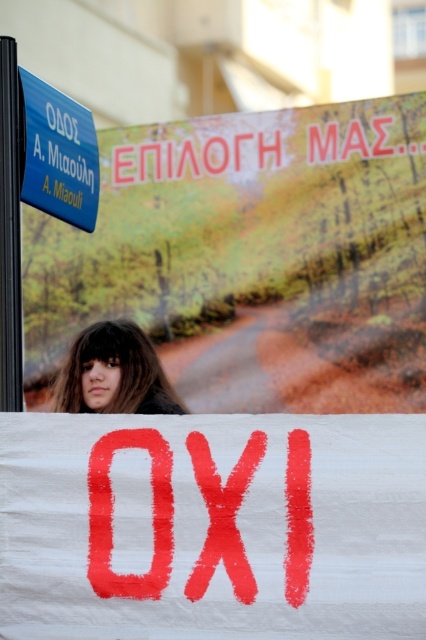
Measure the distance between point (0, 472) and camera.

Point (0, 472) is 3.71 meters from camera.

Which is behind, point (115, 573) or point (37, 90)?

Point (37, 90)

The height and width of the screenshot is (640, 426). In order to click on red painted sign at center in this screenshot , I will do `click(213, 525)`.

Does white paper banner at upper center have a greater width compared to blue plastic sign at upper left?

Correct, the width of white paper banner at upper center exceeds that of blue plastic sign at upper left.

Does white paper banner at upper center appear on the left side of blue plastic sign at upper left?

In fact, white paper banner at upper center is to the right of blue plastic sign at upper left.

Identify the location of white paper banner at upper center. This screenshot has height=640, width=426. (250, 259).

Identify the location of white paper banner at upper center. pos(250,259).

Between point (43, 276) and point (393, 550), which one is positioned behind?

The point (43, 276) is more distant.

At what (x,y) coordinates should I click in order to perform the action: click on white paper banner at upper center. Please return your answer as a coordinate pair (x, y). Looking at the image, I should click on (250, 259).